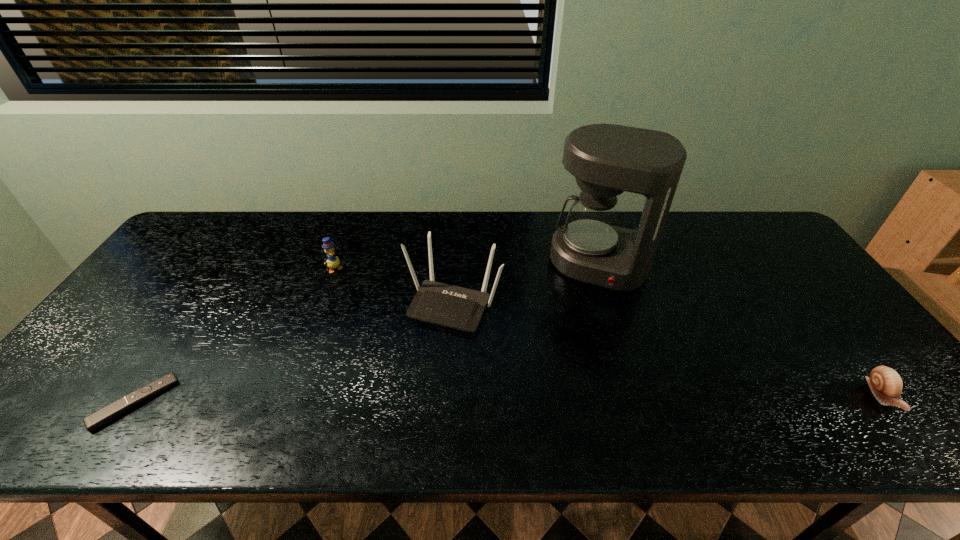
You are a GUI agent. You are given a task and a screenshot of the screen. Output one action in this format:
    pyautogui.click(x=<x>, y=<y>)
    Task: Click on the vacant space on the desktop that is between the shortest object and the rightmost object and is positioned on the face of the second object from left to right, where the monocle is placed
    The image size is (960, 540).
    Given the screenshot: What is the action you would take?
    pyautogui.click(x=449, y=400)

You are a GUI agent. You are given a task and a screenshot of the screen. Output one action in this format:
    pyautogui.click(x=<x>, y=<y>)
    Task: Click on the free space on the desktop that is between the shortest object and the escargot and is positioned on the button side of the fourth object from left to right
    The height and width of the screenshot is (540, 960).
    Given the screenshot: What is the action you would take?
    pyautogui.click(x=557, y=399)

The height and width of the screenshot is (540, 960). What are the coordinates of `vacant space on the desktop that is between the leftmost object and the second shortest object and is positioned on the front-facing side of the fourth shortest object` in the screenshot? It's located at (405, 400).